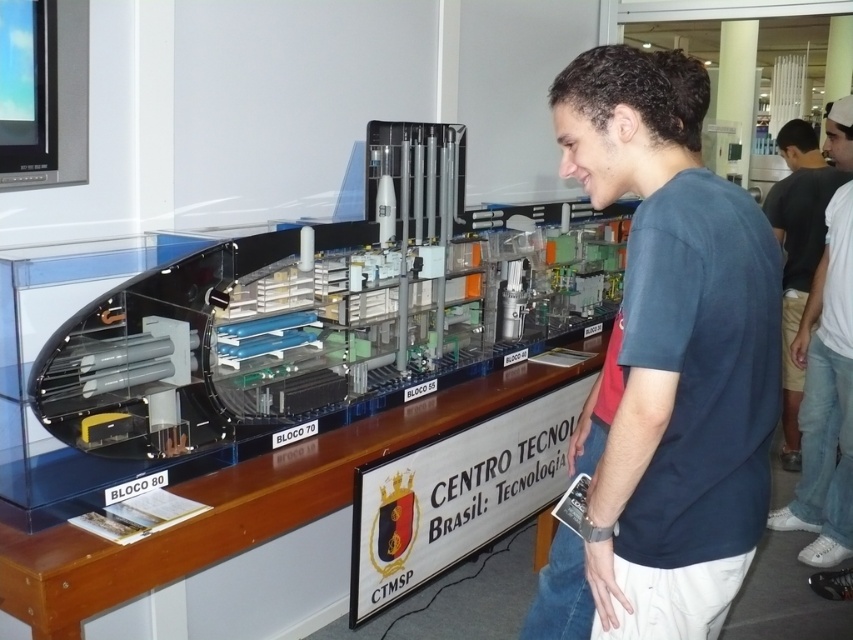
Question: Which object is closer to the camera taking this photo?

Choices:
 (A) dark gray shirt at upper right
 (B) blue cotton t-shirt at center

Answer: (B)

Question: Is blue cotton t-shirt at center further to the viewer compared to dark gray shirt at upper right?

Choices:
 (A) yes
 (B) no

Answer: (B)

Question: Is blue cotton t-shirt at center to the left of dark gray shirt at upper right from the viewer's perspective?

Choices:
 (A) no
 (B) yes

Answer: (B)

Question: Can you confirm if blue cotton t-shirt at center is positioned below dark gray shirt at upper right?

Choices:
 (A) yes
 (B) no

Answer: (A)

Question: Which of the following is the closest to the observer?

Choices:
 (A) (660, 572)
 (B) (850, 177)

Answer: (A)

Question: Which point appears farthest from the camera in this image?

Choices:
 (A) (791, 362)
 (B) (728, 291)

Answer: (A)